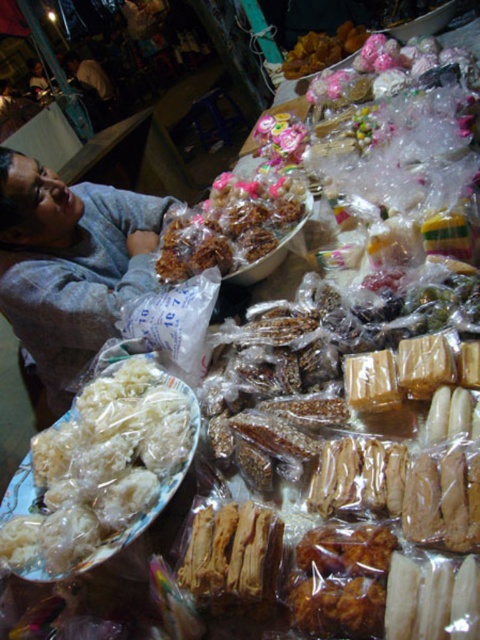
Can you confirm if translucent plastic wrapped at lower left is positioned to the right of brown/crumbly pastry at center?

No, translucent plastic wrapped at lower left is not to the right of brown/crumbly pastry at center.

Who is more distant from viewer, [33,502] or [195,262]?

The point [195,262] is behind.

Does point (22, 493) come closer to viewer compared to point (271, 212)?

Yes, point (22, 493) is closer to viewer.

You are a GUI agent. You are given a task and a screenshot of the screen. Output one action in this format:
    pyautogui.click(x=<x>, y=<y>)
    Task: Click on the translucent plastic wrapped at lower left
    This screenshot has width=480, height=640.
    Given the screenshot: What is the action you would take?
    pyautogui.click(x=99, y=472)